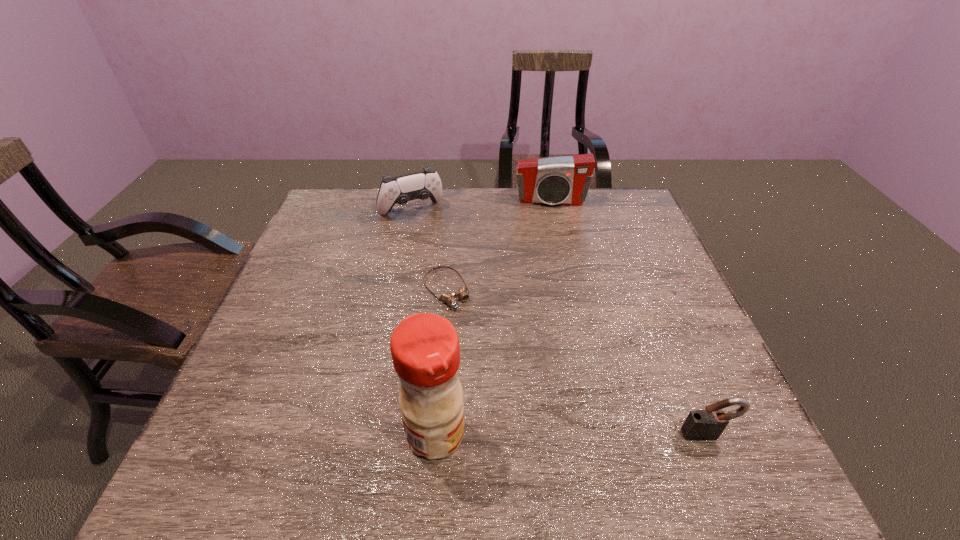
Where is `padlock at the near edge`? The height and width of the screenshot is (540, 960). padlock at the near edge is located at coordinates (700, 425).

At what (x,y) coordinates should I click in order to perform the action: click on object at the right edge. Please return your answer as a coordinate pair (x, y). Looking at the image, I should click on (700, 425).

Find the location of a particular element. Image resolution: width=960 pixels, height=540 pixels. object that is at the near right corner is located at coordinates (700, 425).

At what (x,y) coordinates should I click in order to perform the action: click on blank space at the far edge. Please return your answer as a coordinate pair (x, y). Looking at the image, I should click on (374, 204).

I want to click on vacant area at the left edge, so click(329, 253).

Locate an element on the screen. The image size is (960, 540). vacant space at the right edge of the desktop is located at coordinates (694, 319).

Where is `vacant point at the far left corner`? This screenshot has height=540, width=960. vacant point at the far left corner is located at coordinates (319, 210).

Identify the location of free space between the rightmost object and the third farthest object. This screenshot has width=960, height=540. pyautogui.click(x=576, y=362).

You are a GUI agent. You are given a task and a screenshot of the screen. Output one action in this format:
    pyautogui.click(x=<x>, y=<y>)
    Task: Click on the vacant area that lies between the camera and the control
    
    Given the screenshot: What is the action you would take?
    pyautogui.click(x=481, y=206)

Where is `free point between the control and the fourth object from left to right`? free point between the control and the fourth object from left to right is located at coordinates (481, 206).